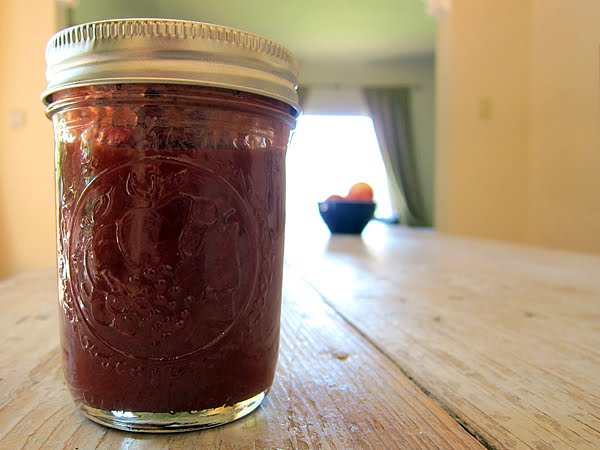
Find the location of a particular element. This screenshot has height=450, width=600. curtain is located at coordinates [x=404, y=156].